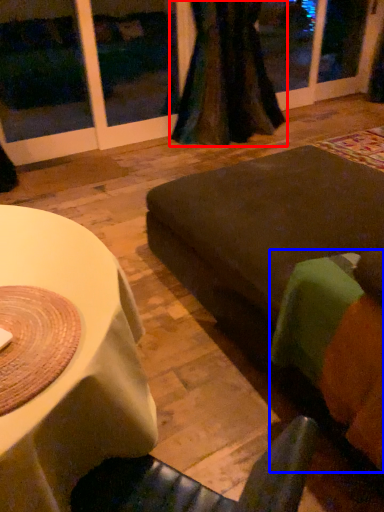
Question: Among these objects, which one is nearest to the camera, curtain (highlighted by a red box) or couch (highlighted by a blue box)?

Choices:
 (A) curtain
 (B) couch

Answer: (B)